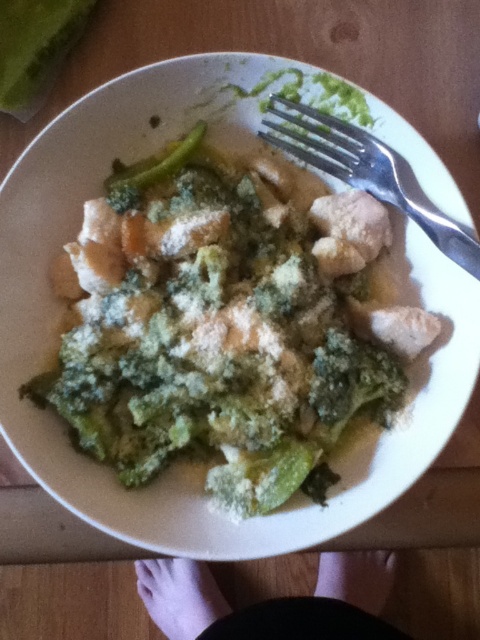
Question: Is pink fabric feet at lower center smaller than green crumbly broccoli at center?

Choices:
 (A) no
 (B) yes

Answer: (A)

Question: Which point is farther from the camera taking this photo?

Choices:
 (A) (120, 408)
 (B) (348, 566)
 (C) (193, 131)
 (D) (330, 397)

Answer: (B)

Question: Is pink fabric feet at lower center wider than green leafy vegetable at center?

Choices:
 (A) no
 (B) yes

Answer: (B)

Question: Among these objects, which one is farthest from the camera?

Choices:
 (A) green leafy vegetable at center
 (B) white powdery chicken at center
 (C) green crumbly broccoli at center

Answer: (A)

Question: Is green crumbly broccoli at center to the right of green leafy vegetable at center from the viewer's perspective?

Choices:
 (A) no
 (B) yes

Answer: (B)

Question: Which point is closer to the camera?

Choices:
 (A) (312, 120)
 (B) (251, 500)
 (C) (179, 616)
 (D) (336, 358)

Answer: (B)